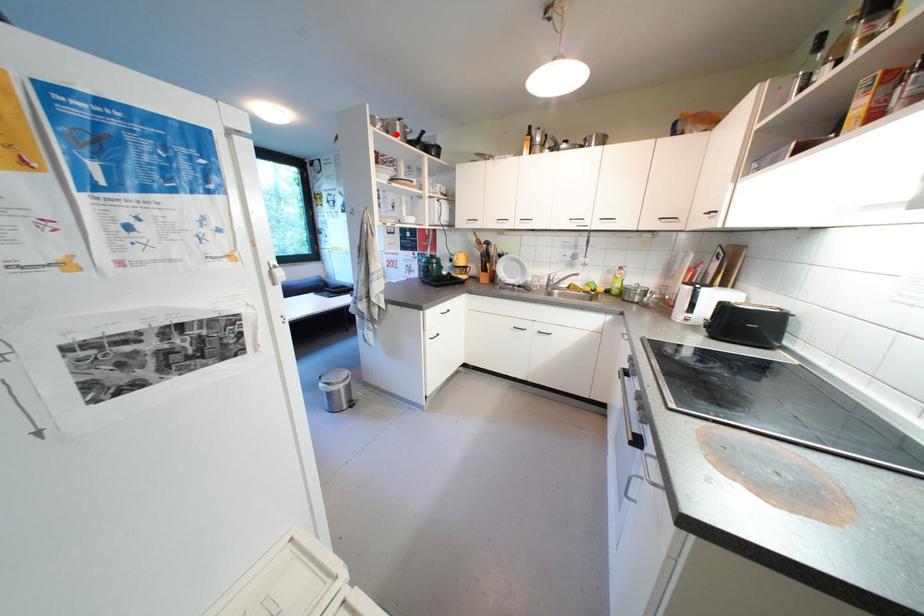
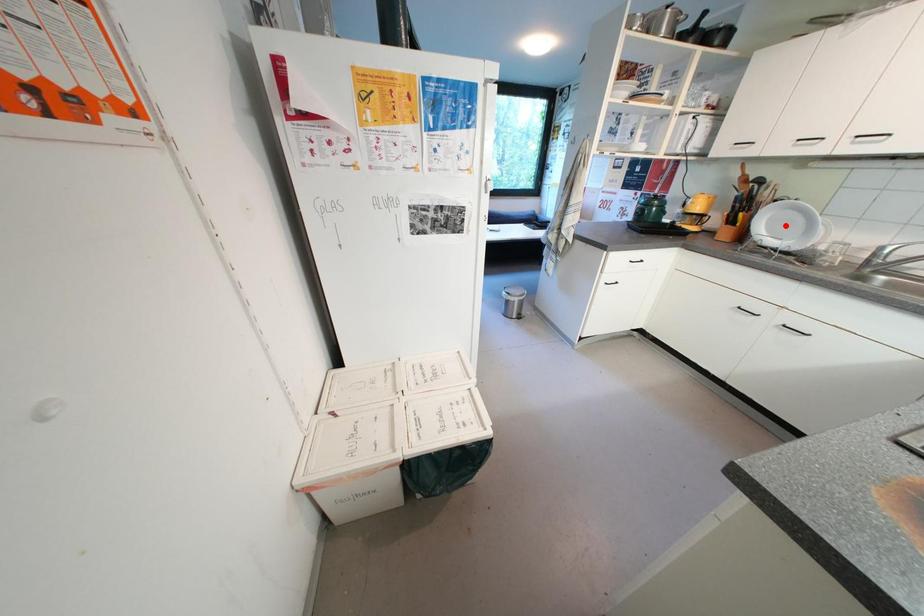
I am providing you with two images of the same scene from different viewpoints. A red point is marked on the first image and another point is marked on the second image. Do the highlighted points in image1 and image2 indicate the same real-world spot?

No